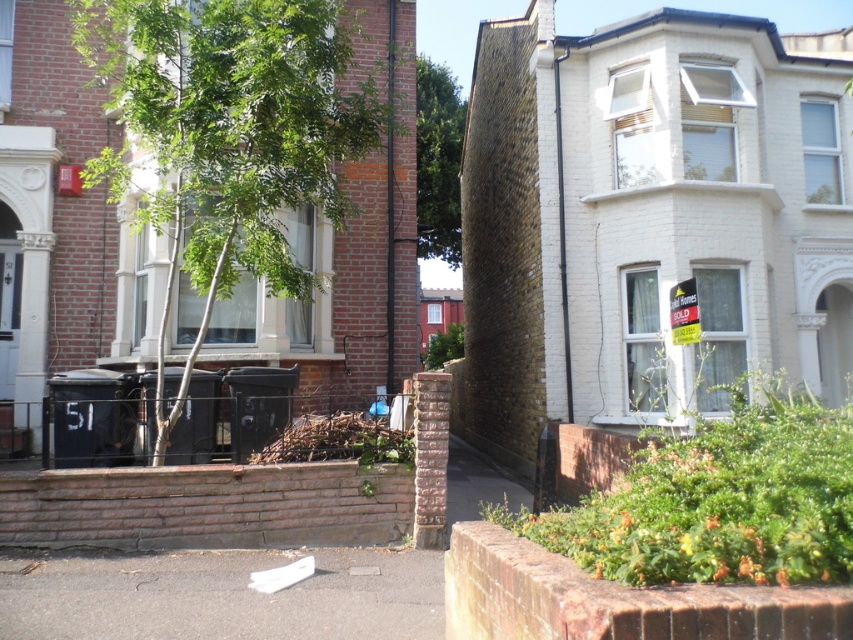
Question: Can you confirm if white asphalt at lower center is smaller than green leafy tree at upper center?

Choices:
 (A) no
 (B) yes

Answer: (A)

Question: Among these points, which one is farthest from the camera?

Choices:
 (A) (252, 102)
 (B) (332, 609)
 (C) (431, 182)

Answer: (C)

Question: Which object appears closest to the camera in this image?

Choices:
 (A) green leafy tree at upper center
 (B) white asphalt at lower center

Answer: (B)

Question: Which point is closer to the camera taking this photo?

Choices:
 (A) (77, 6)
 (B) (419, 68)

Answer: (A)

Question: Observing the image, what is the correct spatial positioning of green leafy tree at left in reference to green leafy tree at upper center?

Choices:
 (A) left
 (B) right

Answer: (A)

Question: Can you confirm if green leafy tree at left is positioned to the left of white asphalt at lower center?

Choices:
 (A) yes
 (B) no

Answer: (A)